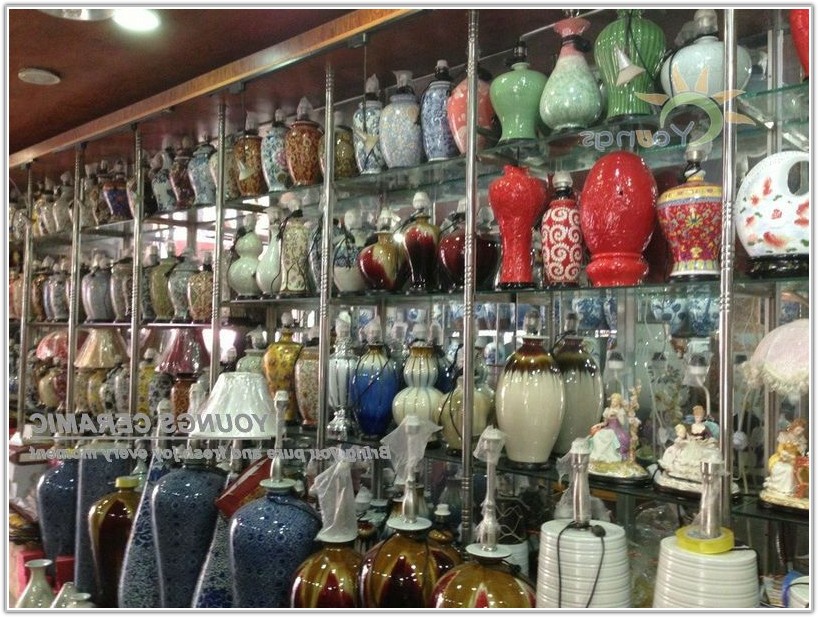
This screenshot has height=617, width=818. Find the location of `ceiling`. ceiling is located at coordinates (74, 47).